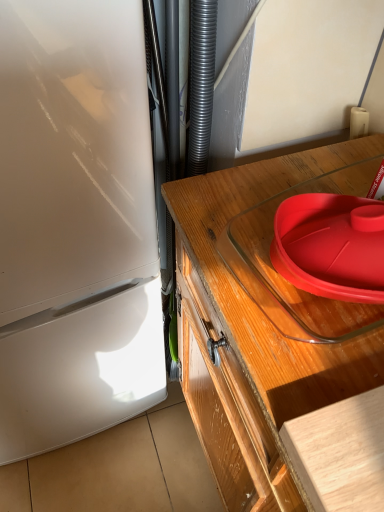
Locate an element on the screen. free space to the left of red plastic lid at upper right is located at coordinates (231, 243).